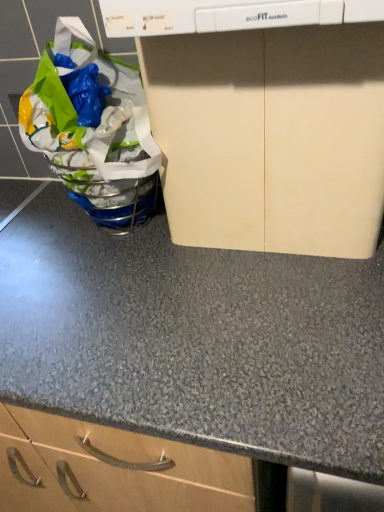
Question: Is point (67, 150) positioned closer to the camera than point (147, 29)?

Choices:
 (A) closer
 (B) farther

Answer: (B)

Question: Considering their positions, is translucent plastic grocery bag at left located in front of or behind beige matte cabinet at upper center?

Choices:
 (A) behind
 (B) front

Answer: (A)

Question: From their relative heights in the image, would you say translucent plastic grocery bag at left is taller or shorter than beige matte cabinet at upper center?

Choices:
 (A) short
 (B) tall

Answer: (B)

Question: Would you say beige matte cabinet at upper center is inside or outside translucent plastic grocery bag at left?

Choices:
 (A) outside
 (B) inside

Answer: (A)

Question: Does point (238, 28) appear closer or farther from the camera than point (69, 128)?

Choices:
 (A) closer
 (B) farther

Answer: (A)

Question: From the image's perspective, is beige matte cabinet at upper center located above or below translucent plastic grocery bag at left?

Choices:
 (A) above
 (B) below

Answer: (B)

Question: From a real-world perspective, is beige matte cabinet at upper center above or below translucent plastic grocery bag at left?

Choices:
 (A) below
 (B) above

Answer: (A)